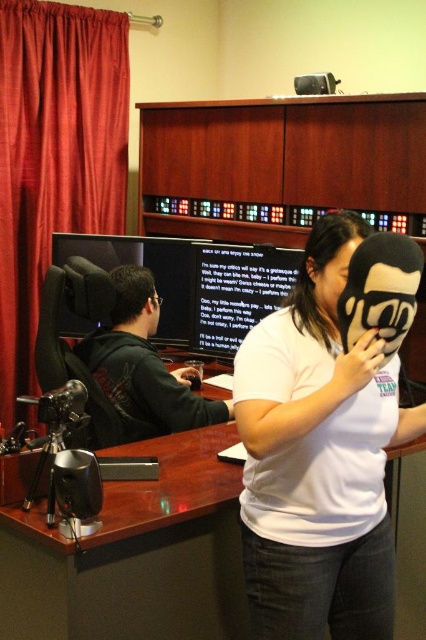
You are setting up a camera to film a video. The camera is positioned so that it can capture both the black glossy computer monitor at center and the matte black mask at center in the frame. Which object will appear taller in the video?

The black glossy computer monitor at center will appear taller in the video because it is taller than the matte black mask at center according to the description.